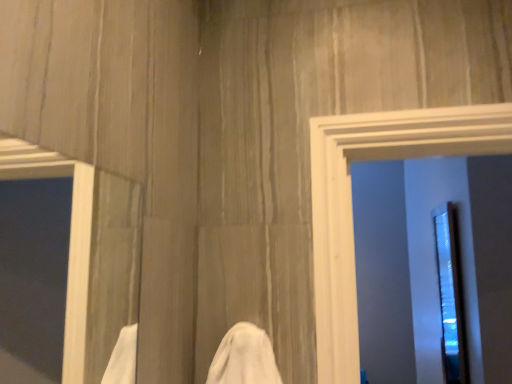
Question: Is white matte frame at left closer to camera compared to transparent plastic screen door at right?

Choices:
 (A) no
 (B) yes

Answer: (B)

Question: Does white matte frame at left have a greater height compared to transparent plastic screen door at right?

Choices:
 (A) yes
 (B) no

Answer: (B)

Question: Considering the relative positions of white matte frame at left and transparent plastic screen door at right in the image provided, is white matte frame at left to the left of transparent plastic screen door at right from the viewer's perspective?

Choices:
 (A) yes
 (B) no

Answer: (A)

Question: Is white matte frame at left located outside transparent plastic screen door at right?

Choices:
 (A) yes
 (B) no

Answer: (A)

Question: Considering the relative sizes of white matte frame at left and transparent plastic screen door at right in the image provided, is white matte frame at left shorter than transparent plastic screen door at right?

Choices:
 (A) no
 (B) yes

Answer: (B)

Question: Is transparent plastic screen door at right inside white matte frame at left?

Choices:
 (A) no
 (B) yes

Answer: (A)

Question: Does transparent plastic screen door at right have a lesser height compared to white matte frame at left?

Choices:
 (A) yes
 (B) no

Answer: (B)

Question: Does transparent plastic screen door at right lie in front of white matte frame at left?

Choices:
 (A) no
 (B) yes

Answer: (A)

Question: Can you see transparent plastic screen door at right touching white matte frame at left?

Choices:
 (A) yes
 (B) no

Answer: (B)

Question: Can you confirm if transparent plastic screen door at right is thinner than white matte frame at left?

Choices:
 (A) no
 (B) yes

Answer: (A)

Question: From a real-world perspective, does transparent plastic screen door at right sit lower than white matte frame at left?

Choices:
 (A) no
 (B) yes

Answer: (B)

Question: From a real-world perspective, is transparent plastic screen door at right positioned over white matte frame at left based on gravity?

Choices:
 (A) yes
 (B) no

Answer: (B)

Question: Is point (6, 172) closer or farther from the camera than point (442, 375)?

Choices:
 (A) farther
 (B) closer

Answer: (B)